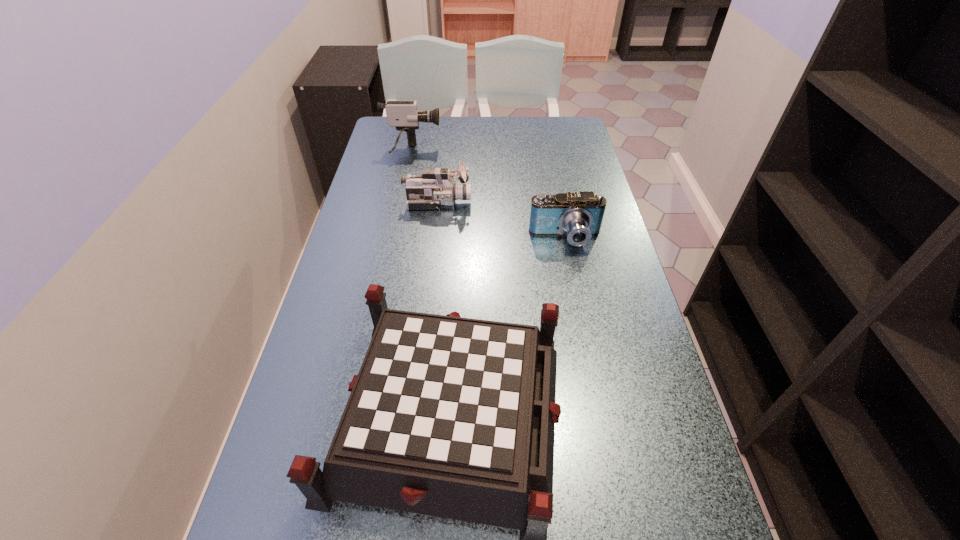
The width and height of the screenshot is (960, 540). In order to click on object at the far left corner in this screenshot , I will do `click(404, 115)`.

This screenshot has width=960, height=540. In order to click on free space at the far edge of the desktop in this screenshot , I will do `click(509, 118)`.

The height and width of the screenshot is (540, 960). In order to click on free spot at the left edge of the desktop in this screenshot , I will do `click(267, 482)`.

Where is `vacant space at the right edge of the desktop`? vacant space at the right edge of the desktop is located at coordinates (595, 181).

I want to click on vacant space at the far left corner, so click(x=408, y=147).

The height and width of the screenshot is (540, 960). What are the coordinates of `vacant area that lies between the second nearest camcorder and the nearest camcorder` in the screenshot? It's located at (501, 220).

I want to click on free space between the second nearest object and the tallest camcorder, so click(489, 195).

This screenshot has width=960, height=540. Find the location of `vacant space in between the third farthest object and the farthest camcorder`. vacant space in between the third farthest object and the farthest camcorder is located at coordinates (489, 195).

At what (x,y) coordinates should I click in order to perform the action: click on free space that is in between the farthest object and the second nearest object. Please return your answer as a coordinate pair (x, y). Looking at the image, I should click on (489, 195).

Where is `vacant space in between the farthest object and the nearest camcorder`? This screenshot has height=540, width=960. vacant space in between the farthest object and the nearest camcorder is located at coordinates pos(489,195).